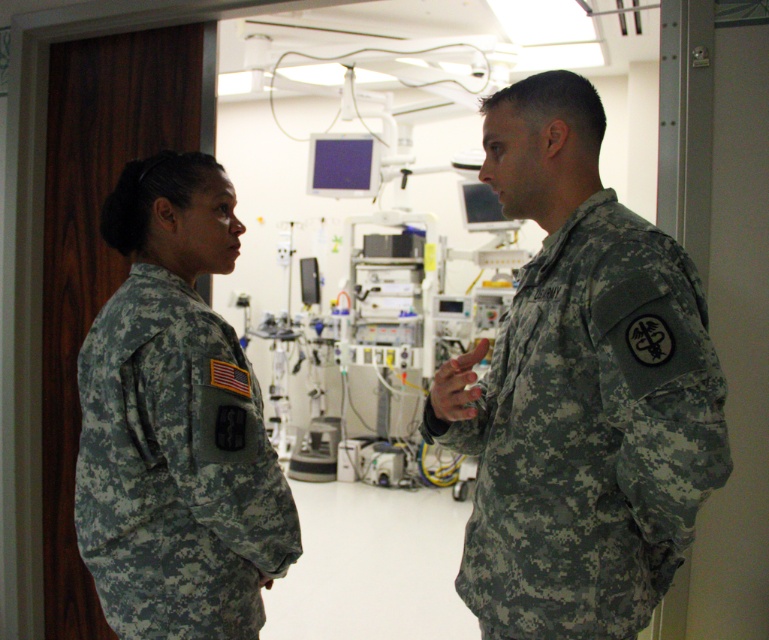
You are a photographer positioned in front of the two military personnel. You need to take a photo where both are visible. Since the camouflage uniform at right is to the right of camouflage uniform at left, which side should you position yourself to ensure both are framed properly?

You should position yourself to the left side of the camouflage uniform at left to ensure both the camouflage uniform at left and the camouflage uniform at right are framed properly in the photo.

You are a photographer trying to capture a photo of the camouflage uniform at right and the camouflage fabric monitor at center. Which object should you focus on first if you want to include both in your frame without moving the camera?

The camouflage uniform at right is shorter than the camouflage fabric monitor at center, so you should focus on the camouflage uniform at right first to ensure both are in frame.

You are a photographer setting up a photo shoot in this hospital room. You need to position the camouflage uniform at left and the camouflage fabric monitor at center so that they are both visible in the frame. Given their sizes, which object should you place closer to the camera to ensure both are fully visible?

The camouflage uniform at left has a lesser width compared to the camouflage fabric monitor at center. To ensure both are fully visible in the frame, you should place the camouflage uniform at left closer to the camera since smaller objects need to be nearer to maintain visibility alongside larger ones.